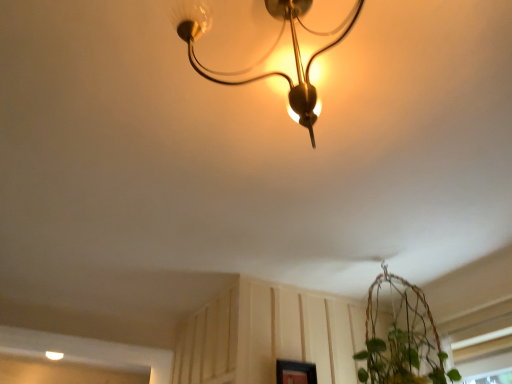
You are a GUI agent. You are given a task and a screenshot of the screen. Output one action in this format:
    pyautogui.click(x=<x>, y=<y>)
    Task: Click on the matte black picture frame at lower right
    
    Given the screenshot: What is the action you would take?
    pyautogui.click(x=295, y=372)

Measure the distance between matte black picture frame at lower right and camera.

matte black picture frame at lower right is 1.89 meters from camera.

This screenshot has height=384, width=512. What do you see at coordinates (295, 372) in the screenshot?
I see `matte black picture frame at lower right` at bounding box center [295, 372].

You are a GUI agent. You are given a task and a screenshot of the screen. Output one action in this format:
    pyautogui.click(x=<x>, y=<y>)
    Task: Click on the matte black picture frame at lower right
    The image size is (512, 384).
    Given the screenshot: What is the action you would take?
    pyautogui.click(x=295, y=372)